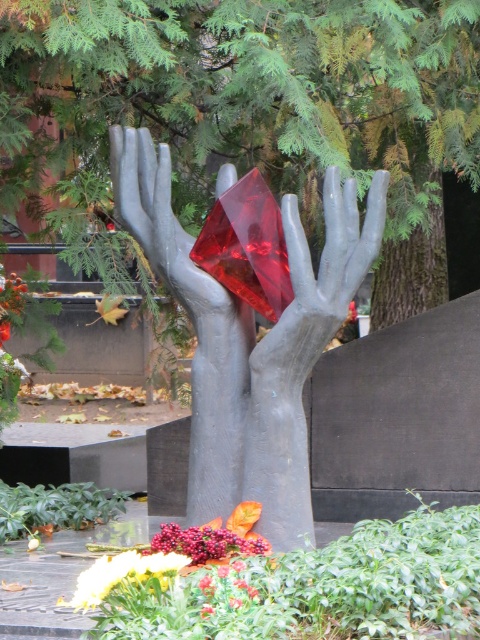
Question: Which point is closer to the camera taking this photo?

Choices:
 (A) (256, 438)
 (B) (299, 132)
 (C) (290, 372)

Answer: (C)

Question: Which point is closer to the camera taking this photo?

Choices:
 (A) 300,385
 (B) 291,467

Answer: (B)

Question: Which of these objects is positioned closest to the matte gray hand at center?

Choices:
 (A) matte red diamond at center
 (B) green leafy tree at center

Answer: (A)

Question: Is green leafy tree at center in front of matte gray hand at center?

Choices:
 (A) no
 (B) yes

Answer: (A)

Question: Is green leafy tree at center to the left of matte gray hand at center from the viewer's perspective?

Choices:
 (A) yes
 (B) no

Answer: (A)

Question: Does green leafy tree at center have a larger size compared to matte red diamond at center?

Choices:
 (A) yes
 (B) no

Answer: (A)